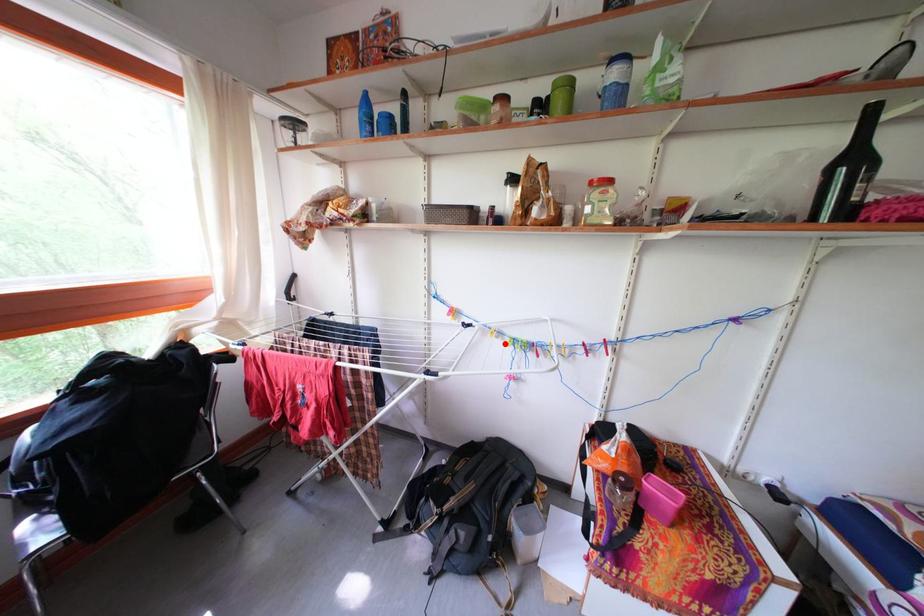
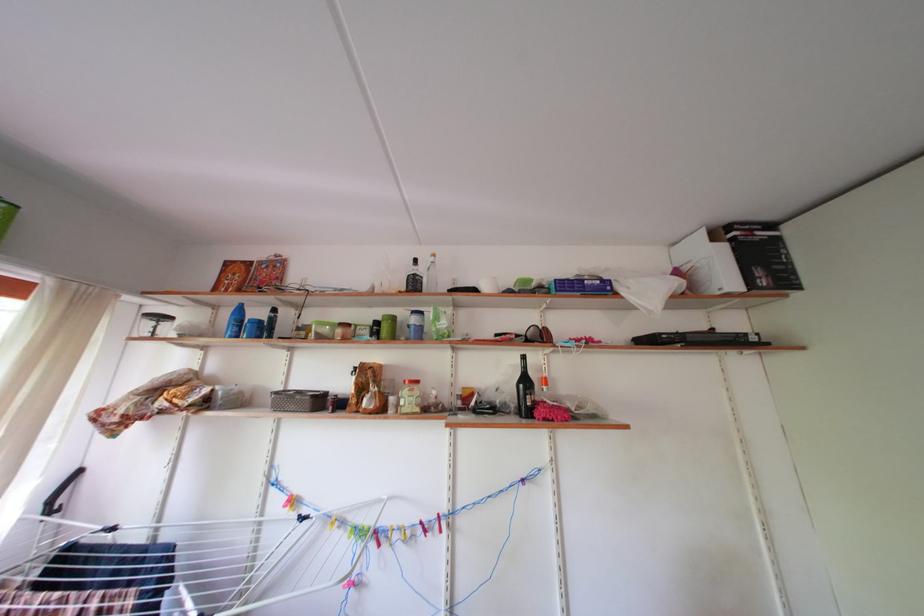
Question: I am providing you with two images of the same scene from different viewpoints. A red point is marked on the first image. Is the red point's position out of view in image 2?

Choices:
 (A) Yes
 (B) No

Answer: (B)